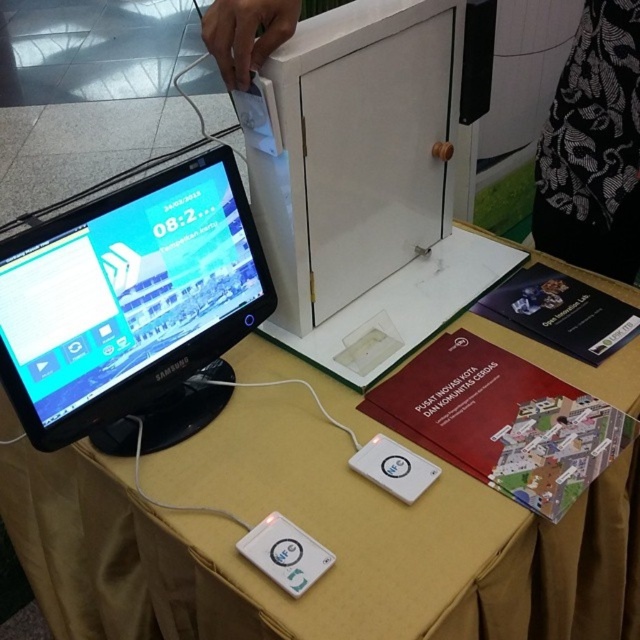
You are setting up a display at an event and need to ensure that the matte black monitor at left and the white plastic ipod at lower center are visible to attendees. Given their sizes, which object might require a higher stand to be seen clearly?

The matte black monitor at left is taller than the white plastic ipod at lower center, so the ipod might need a higher stand to ensure visibility, as it is shorter.

From the picture: What are the coordinates of the matte black monitor at left in the image?

The matte black monitor at left is located at coordinates point (131, 307).

In the scene shown: You are organizing a tech exhibition and need to place the white plastic nfc tag at lower center and the white plastic ipod at lower center on a shelf. Which object should be placed first if you want to stack them vertically based on their height?

The white plastic nfc tag at lower center should be placed first since it has a greater height compared to the white plastic ipod at lower center, allowing the shorter iPod to be stacked on top without stability issues.